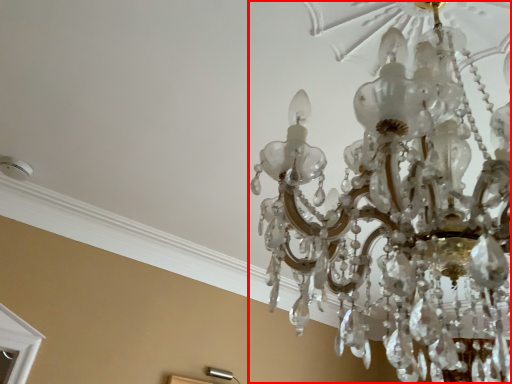
Question: From the image's perspective, where is lamp (annotated by the red box) located relative to lamp?

Choices:
 (A) above
 (B) below

Answer: (A)